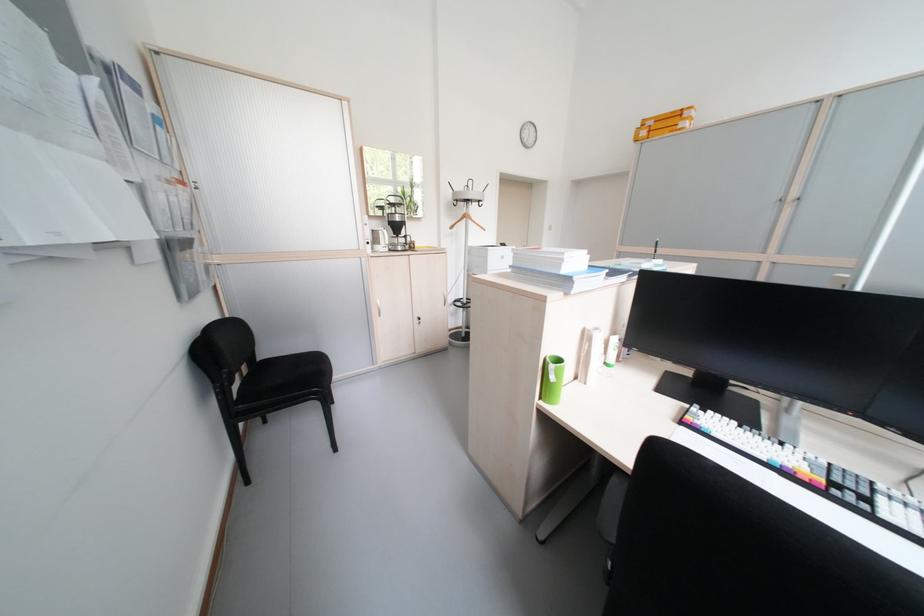
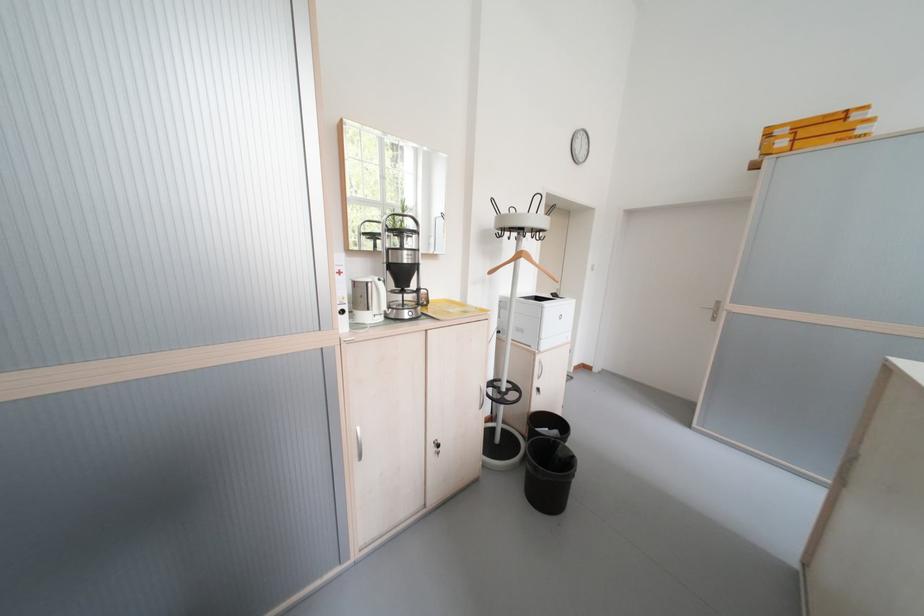
Where in the second image is the point corresponding to the point at 384,314 from the first image?

(359, 455)